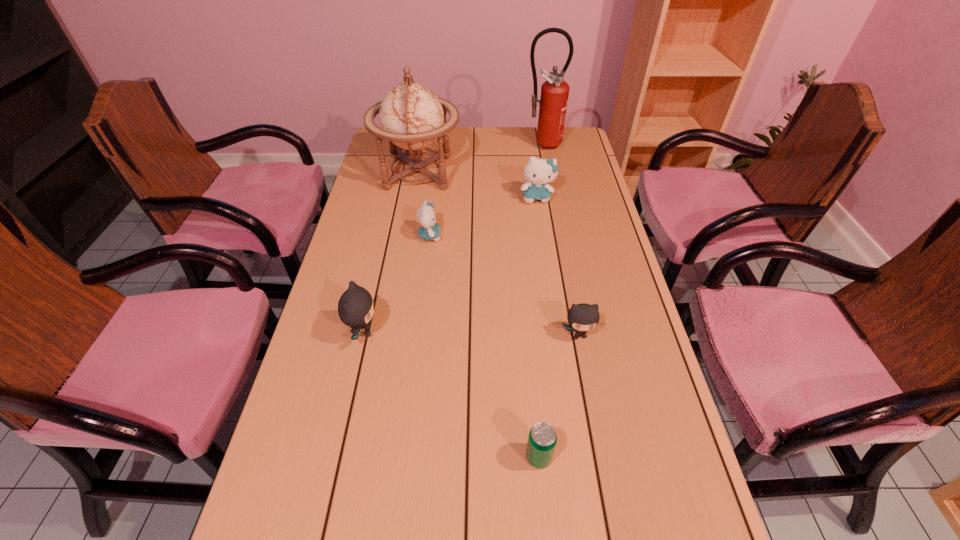
I want to click on empty space that is in between the third nearest kitten and the farthest kitten, so click(484, 217).

Locate an element on the screen. The width and height of the screenshot is (960, 540). vacant region between the globe and the beer can is located at coordinates (478, 315).

I want to click on vacant region between the globe and the beer can, so click(x=478, y=315).

What are the coordinates of `vacant space that is in between the bigger blue kitten and the smaller gray kitten` in the screenshot? It's located at (558, 266).

Locate an element on the screen. object that is the third closest to the globe is located at coordinates (553, 102).

I want to click on object that can be found as the second closest to the globe, so click(539, 172).

Locate which kitten is the third closest to the globe. Please provide its 2D coordinates. Your answer should be formatted as a tuple, i.e. [(x, y)], where the tuple contains the x and y coordinates of a point satisfying the conditions above.

[(355, 307)]

This screenshot has width=960, height=540. What are the coordinates of `the third closest kitten relative to the leftmost kitten` in the screenshot? It's located at point(539,172).

The width and height of the screenshot is (960, 540). Find the location of `free point that satisfies the following two spatial constraints: 1. on the front-facing side of the leftmost kitten; 2. on the right side of the nearest object`. free point that satisfies the following two spatial constraints: 1. on the front-facing side of the leftmost kitten; 2. on the right side of the nearest object is located at coordinates (335, 457).

The image size is (960, 540). In order to click on free space that satisfies the following two spatial constraints: 1. at the nozzle of the fire extinguisher; 2. on the face of the second kitten from left to right in this screenshot , I will do `click(560, 236)`.